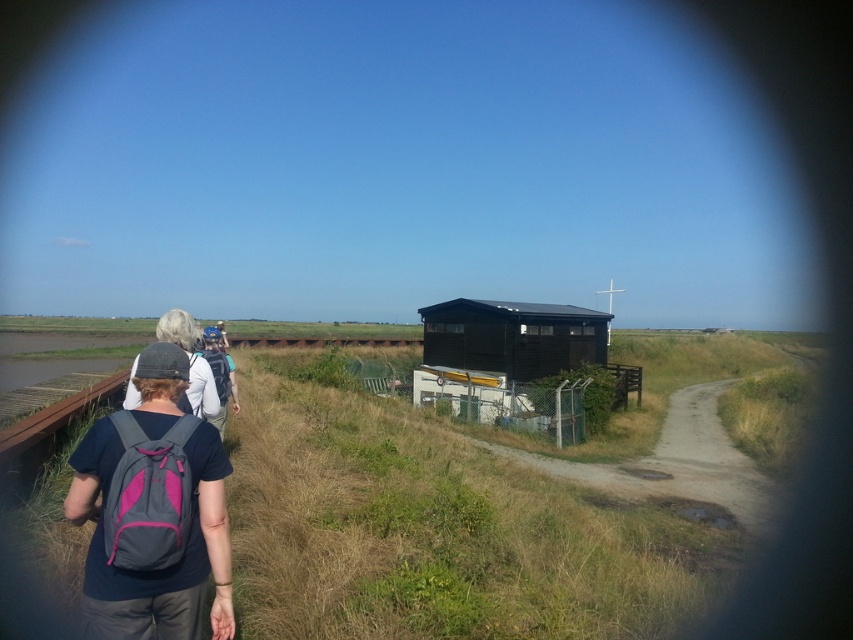
Question: Which point is closer to the camera?

Choices:
 (A) (223, 378)
 (B) (544, 356)
 (C) (645, 465)

Answer: (A)

Question: Is brown wooden hut at center positioned before gray fabric hat at upper left?

Choices:
 (A) yes
 (B) no

Answer: (B)

Question: Which of the following is the closest to the observer?

Choices:
 (A) (641, 486)
 (B) (225, 378)
 (C) (120, 448)
 (D) (212, 410)

Answer: (C)

Question: Can you confirm if gray fabric backpack at lower left is positioned to the right of gray fabric hat at upper left?

Choices:
 (A) yes
 (B) no

Answer: (A)

Question: Which object is the farthest from the gray fabric hat at upper left?

Choices:
 (A) brown wooden hut at center
 (B) matte gray backpack at center

Answer: (A)

Question: Can you confirm if brown wooden hut at center is wider than matte gray backpack at center?

Choices:
 (A) yes
 (B) no

Answer: (A)